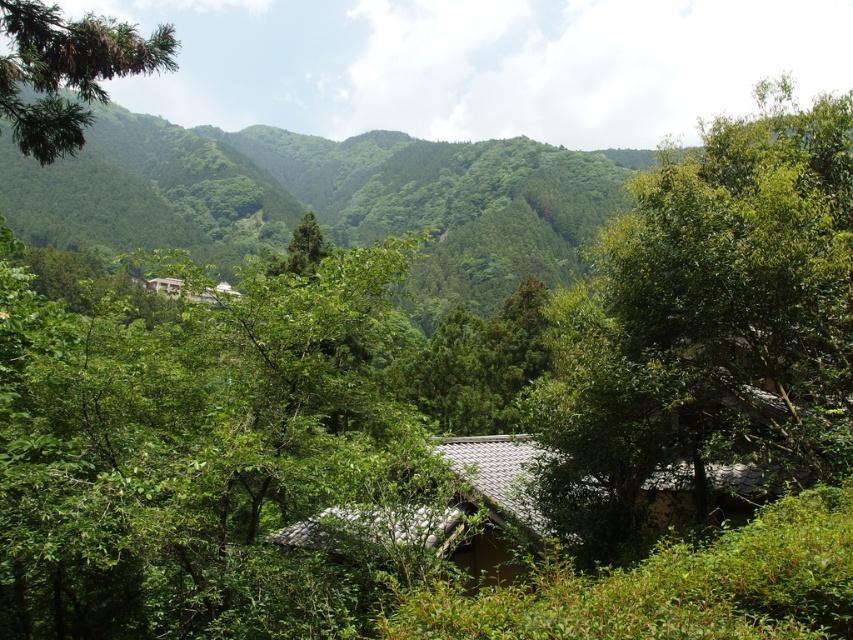
You are an architect designing a new garden path that must pass between the brown tile roof hut at center and the green leafy branch at upper left. Based on their sizes, which object will require more consideration in terms of space allocation for the path?

The green leafy branch at upper left will require more consideration in terms of space allocation for the path since it occupies more space than the brown tile roof hut at center.